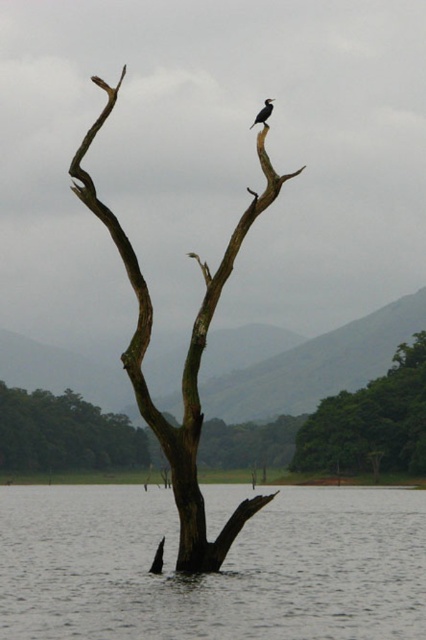
Is brown rough branch at center closer to camera compared to dark gray feathers at upper center?

That is True.

Is point (239, 518) positioned after point (264, 116)?

No, (239, 518) is closer to viewer.

I want to click on brown rough branch at center, so click(x=184, y=360).

Who is positioned more to the left, brown rough branch at center or green leafy tree at center?

Positioned to the left is brown rough branch at center.

Who is more forward, [126,371] or [340,401]?

Point [126,371] is in front.

Locate an element on the screen. This screenshot has height=640, width=426. brown rough branch at center is located at coordinates (184, 360).

In the scene shown: Does green leafy tree at center have a greater width compared to dark gray feathers at upper center?

Correct, the width of green leafy tree at center exceeds that of dark gray feathers at upper center.

This screenshot has height=640, width=426. Identify the location of green leafy tree at center. (371, 422).